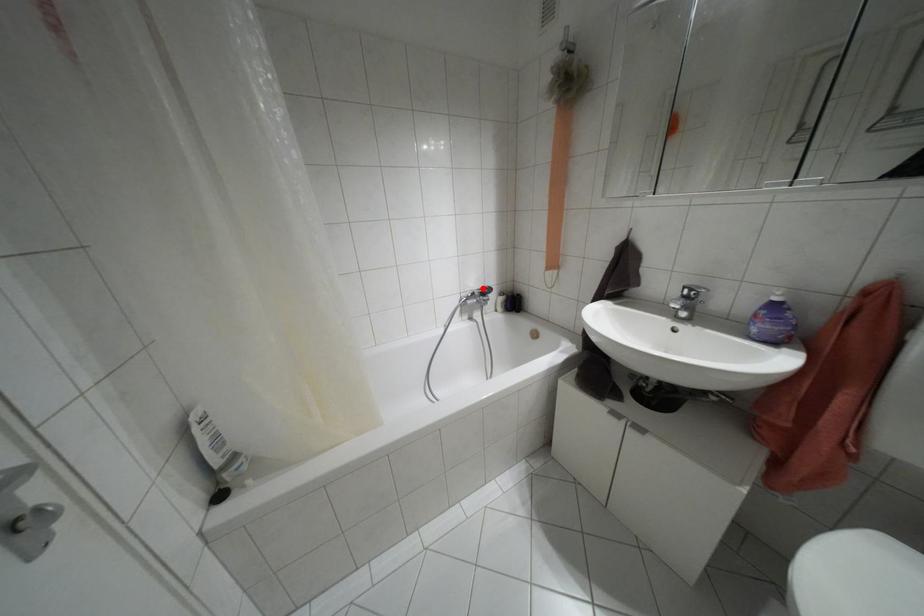
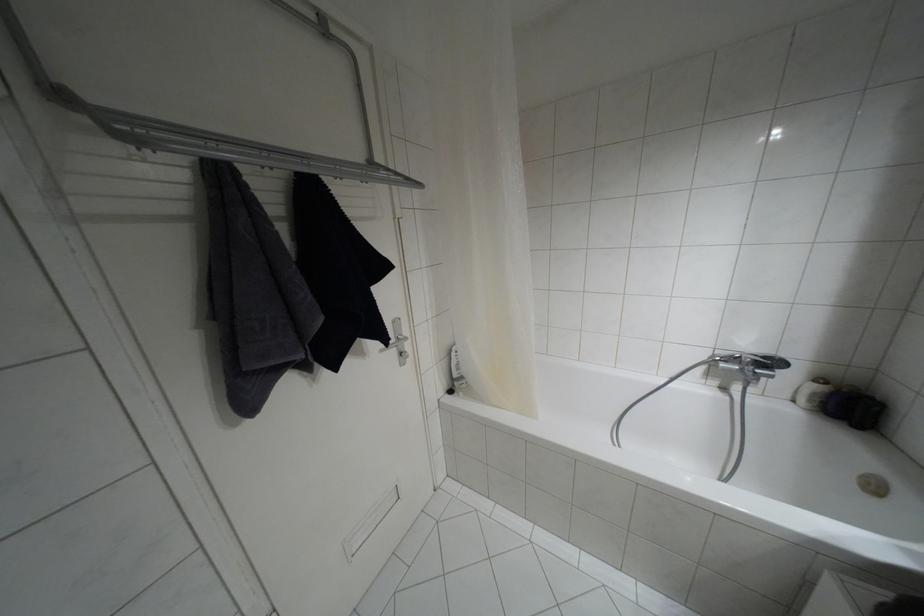
Locate, in the second image, the point that corresponds to the highlighted location in the first image.

(763, 357)